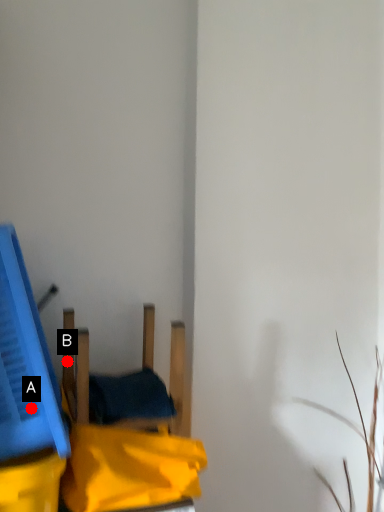
Question: Two points are circled on the image, labeled by A and B beside each circle. Which point is closer to the camera taking this photo?

Choices:
 (A) A is closer
 (B) B is closer

Answer: (A)